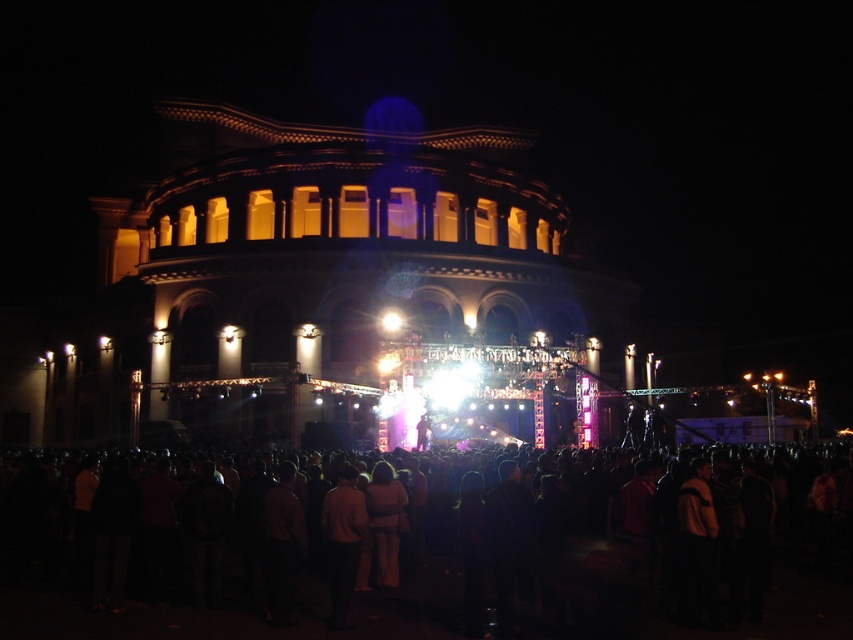
You are a photographer at the concert and want to capture a clear photo of both the light brown leather jacket at center and the light brown fabric pants at center. Since the lighting is low, you need to adjust your camera settings. Considering their sizes, which object should you focus on first to ensure both are in focus?

The light brown leather jacket at center is larger in size than the light brown fabric pants at center, so you should focus on the light brown leather jacket at center first to ensure both are in focus.

You are standing at point (x=393, y=570) and want to move to the stage area. Is point (x=614, y=596) between you and the stage?

Yes, point (x=614, y=596) is between you and the stage area because it is in front of point (x=393, y=570) where you are standing.